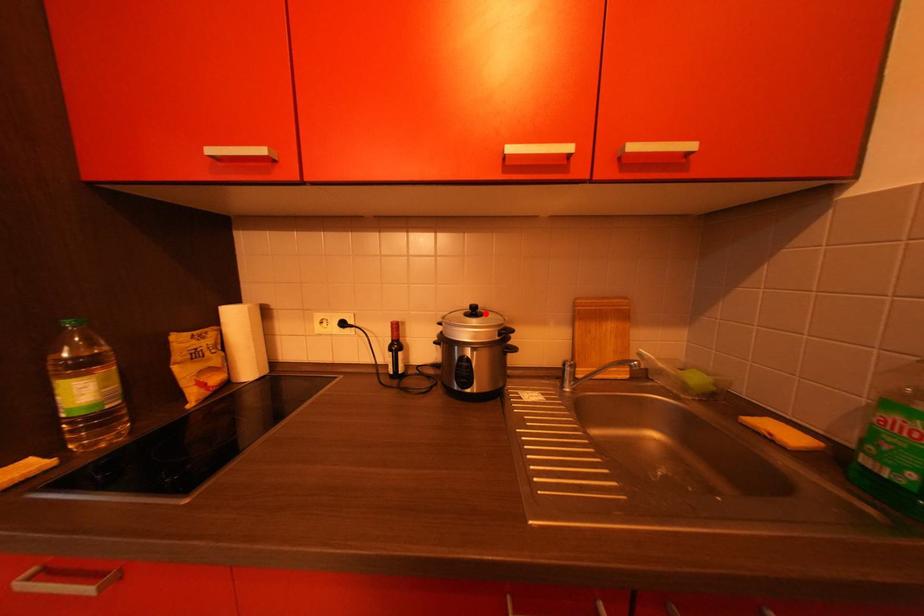
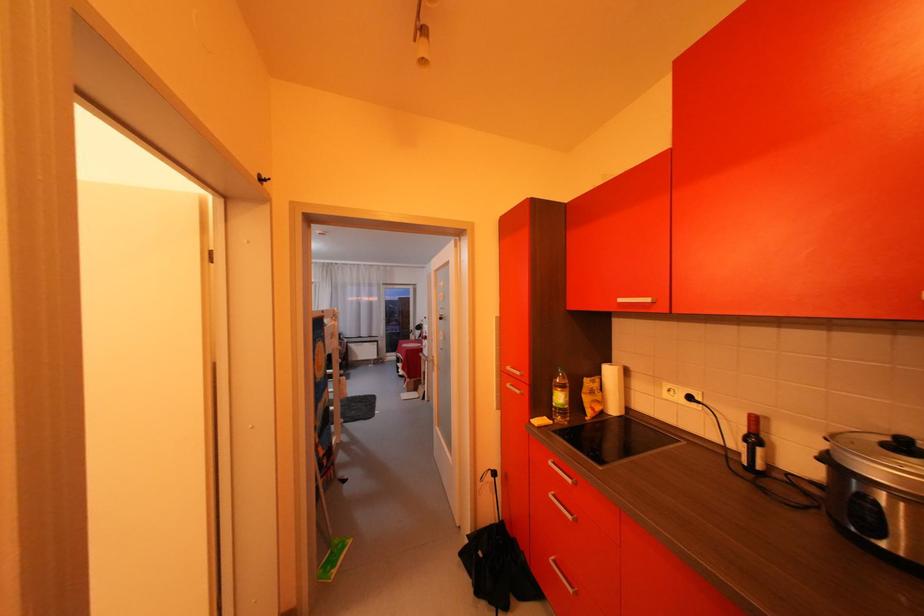
Question: I am providing you with two images of the same scene from different viewpoints. In image1, a red point is highlighted. Considering the same 3D point in image2, which of the following is correct?

Choices:
 (A) It is closer
 (B) It is farther

Answer: (A)